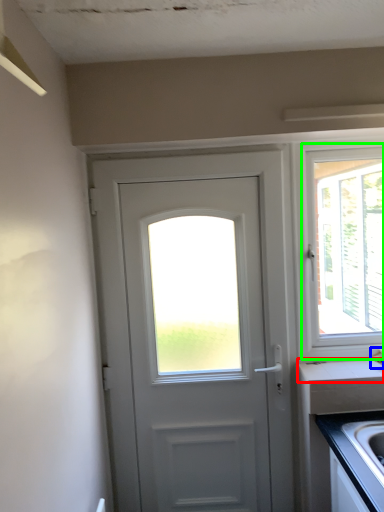
Question: Which object is the farthest from counter top (highlighted by a red box)? Choose among these: faucet (highlighted by a blue box) or window (highlighted by a green box).

Choices:
 (A) faucet
 (B) window

Answer: (B)